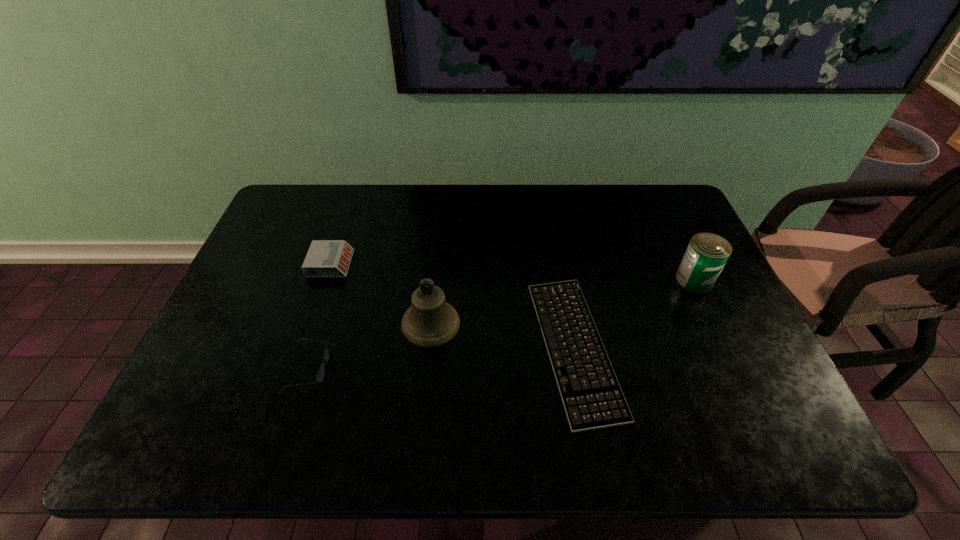
Where is `free space that is in between the shortest object and the bell`? free space that is in between the shortest object and the bell is located at coordinates (502, 335).

At what (x,y) coordinates should I click in order to perform the action: click on free point between the second object from right to left and the can. Please return your answer as a coordinate pair (x, y). This screenshot has width=960, height=540. Looking at the image, I should click on (635, 314).

Locate an element on the screen. The image size is (960, 540). vacant space that's between the third object from right to left and the second object from right to left is located at coordinates (502, 335).

This screenshot has width=960, height=540. In order to click on unoccupied position between the second shortest object and the third shortest object in this screenshot , I will do `click(320, 316)`.

Image resolution: width=960 pixels, height=540 pixels. In order to click on free area in between the bell and the shortest object in this screenshot , I will do `click(502, 335)`.

Locate an element on the screen. This screenshot has height=540, width=960. free space between the alarm clock and the tallest object is located at coordinates click(x=380, y=294).

This screenshot has height=540, width=960. What are the coordinates of `free space between the shortest object and the bell` in the screenshot? It's located at (502, 335).

Identify the location of unoccupied area between the bell and the third tallest object. This screenshot has height=540, width=960. (380, 294).

The width and height of the screenshot is (960, 540). I want to click on blank region between the sunglasses and the bell, so click(370, 346).

Where is `vacant space in between the sunglasses and the bell`? vacant space in between the sunglasses and the bell is located at coordinates (370, 346).